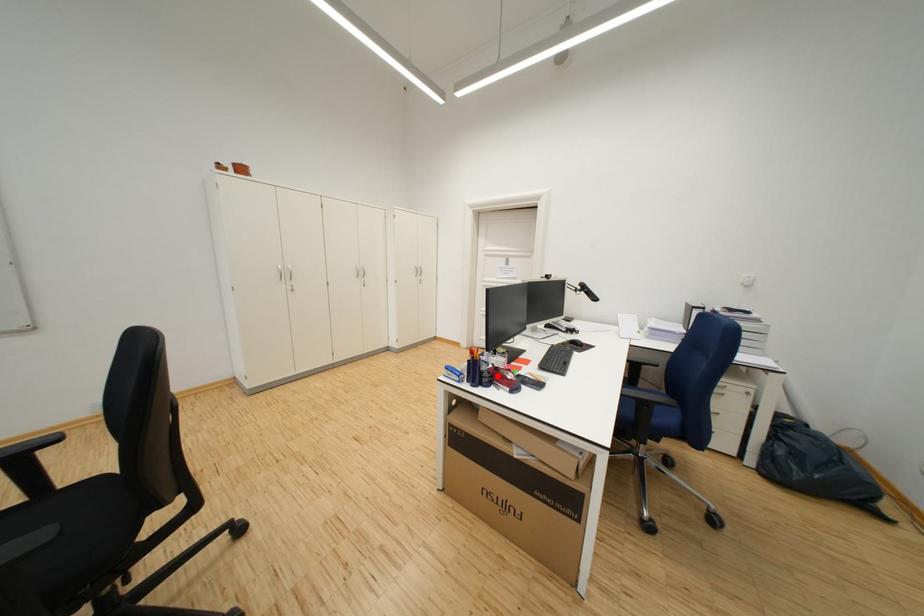
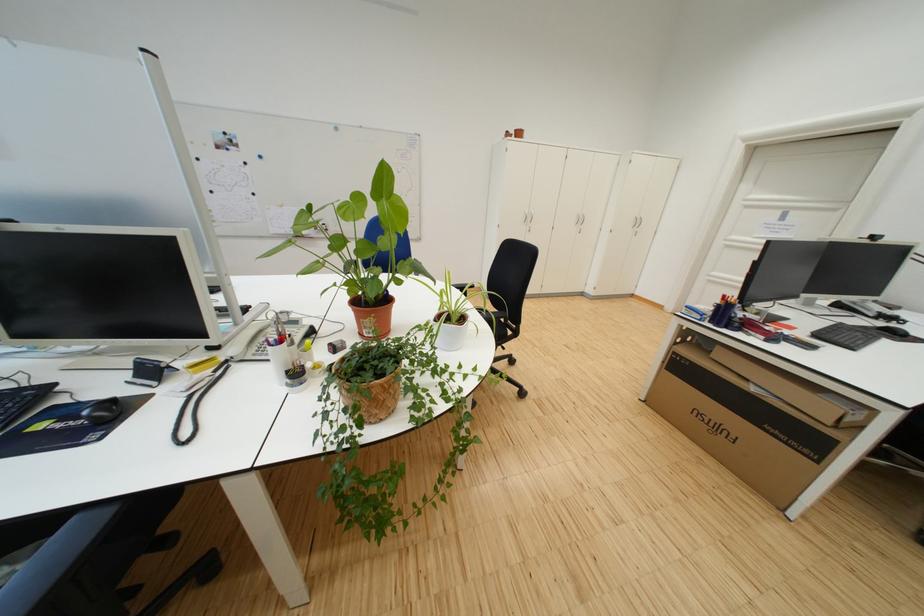
Find the pixel in the second image that matches the highlighted location in the first image.

(748, 322)